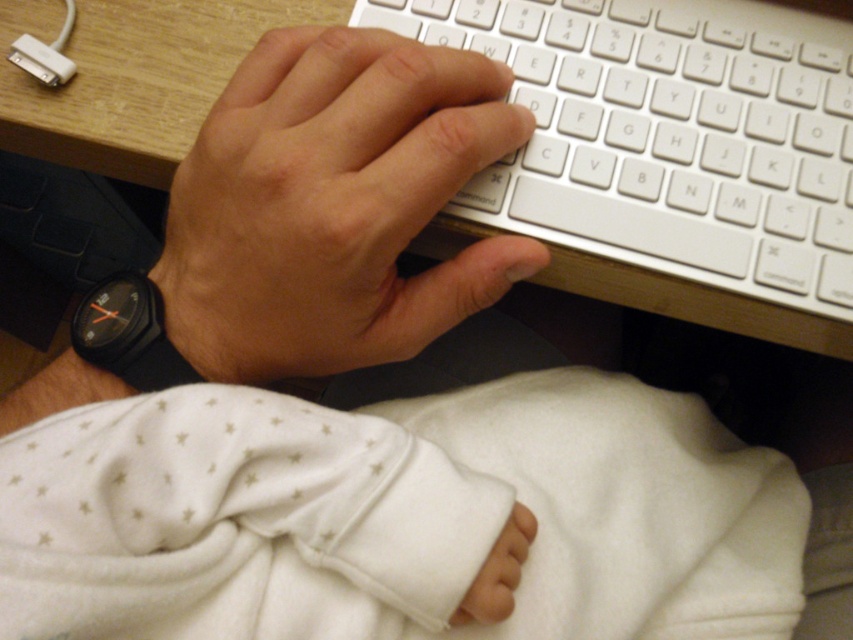
Question: Which of the following is the closest to the observer?

Choices:
 (A) click(204, 240)
 (B) click(141, 10)

Answer: (A)

Question: In this image, where is smooth skin hand at center located relative to wooden at upper center?

Choices:
 (A) above
 (B) below

Answer: (B)

Question: Can you confirm if smooth skin hand at center is positioned below wooden at upper center?

Choices:
 (A) no
 (B) yes

Answer: (B)

Question: Is smooth skin hand at center bigger than wooden at upper center?

Choices:
 (A) no
 (B) yes

Answer: (A)